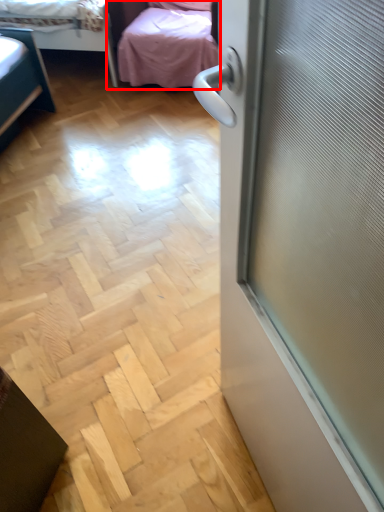
Question: From the image's perspective, considering the relative positions of studio couch (annotated by the red box) and bed in the image provided, where is studio couch (annotated by the red box) located with respect to the staircase?

Choices:
 (A) below
 (B) above

Answer: (A)